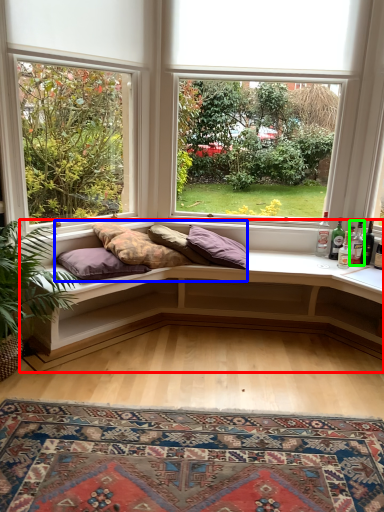
Question: Which object is the closest to the studio couch (highlighted by a red box)? Choose among these: bedding (highlighted by a blue box) or bottle (highlighted by a green box).

Choices:
 (A) bedding
 (B) bottle

Answer: (A)